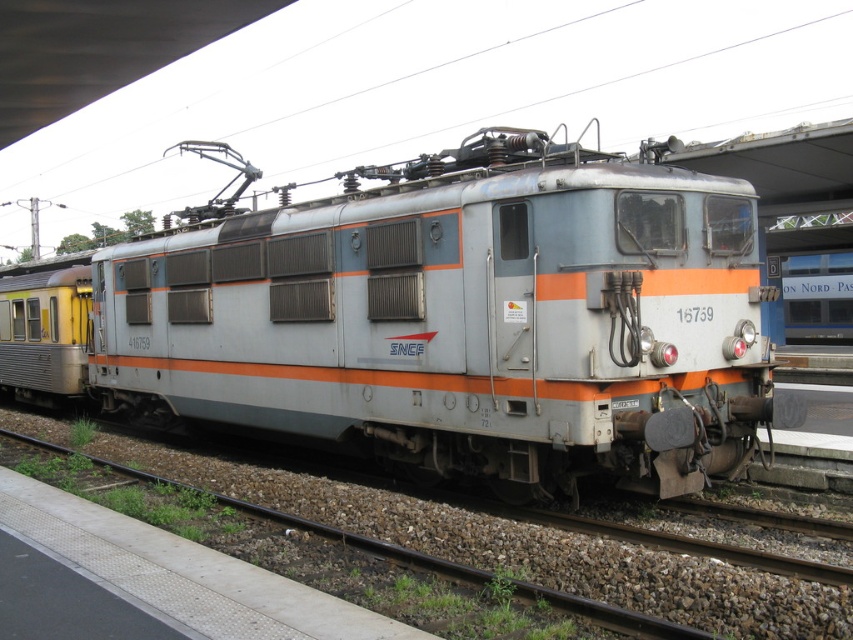
Question: Does matte silver train at center have a smaller size compared to yellow matte train car at left?

Choices:
 (A) no
 (B) yes

Answer: (A)

Question: Which point is closer to the camera taking this photo?

Choices:
 (A) (115, 301)
 (B) (27, 364)
 (C) (798, 288)

Answer: (A)

Question: Which of the following is the closest to the observer?

Choices:
 (A) (804, 314)
 (B) (688, 179)

Answer: (B)

Question: Can you confirm if yellow matte train car at left is positioned below silver metallic train at center?

Choices:
 (A) no
 (B) yes

Answer: (B)

Question: Which point is farther to the camera?

Choices:
 (A) pyautogui.click(x=817, y=269)
 (B) pyautogui.click(x=13, y=308)

Answer: (A)

Question: Does matte silver train at center have a larger size compared to yellow matte train car at left?

Choices:
 (A) no
 (B) yes

Answer: (B)